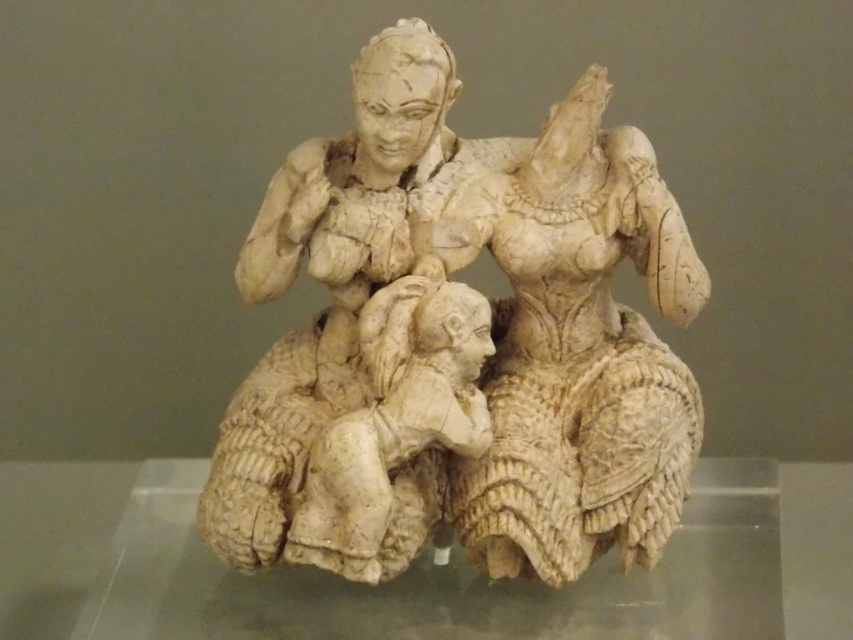
You are an art conservator examining the ceramic sculpture. You need to clean the transparent glass table at center without touching the matte beige figure at center. Can you reach the table from your current position in front of the sculpture?

The matte beige figure at center is closer to the viewer than the transparent glass table at center, so the figure is blocking access to the table. You cannot reach the table without moving the figure.

You are an art conservator standing 1.5 meters away from the ivory sculpture at center. You need to clean it with a brush that has a 30 cm handle. Can you reach the sculpture without moving closer?

The ivory sculpture at center is 1.19 meters away from the camera. Since you are standing 1.5 meters away, you are 0.31 meters farther than the sculpture. The brush handle is 30 cm long, which is 0.3 meters. Therefore, you cannot reach the sculpture without moving closer because the distance between you and the sculpture exceeds the brush handle length.